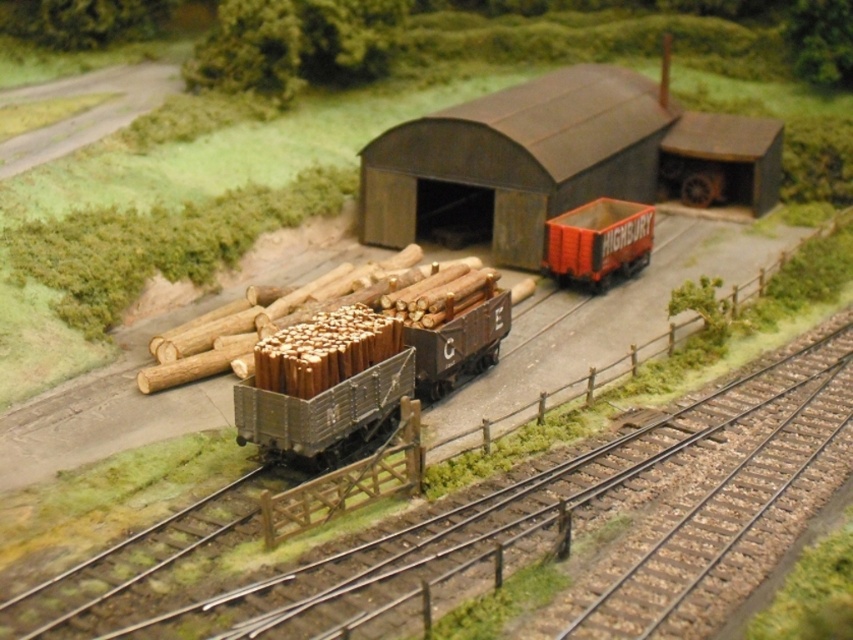
You are a miniature figure standing at the point with coordinates point (602, 234). You want to walk to the point with coordinates point (384, 620). Which direction should you move relative to your current position?

You should move forward because point (384, 620) is in front of point (602, 234).

You are a toy train operator who needs to move a new wagon through the space between the dark gray corrugated metal barn at center and the orange plastic truck at center. The wagon is 3.5 feet wide. Will it fit through the space?

The distance between the dark gray corrugated metal barn at center and the orange plastic truck at center is 3.79 feet. Since the wagon is 3.5 feet wide, it will fit through the space as there is enough clearance.

You are a model train enthusiast planning to place a new locomotive that is 20 feet long on the track. The locomotive needs at least 25 feet of clear space in front of it to safely stop. Is there enough space between the metal track at center and the orange plastic truck at center to accommodate this requirement?

The distance between the metal track at center and the orange plastic truck at center is 24.06 feet, which is less than the required 25 feet. Therefore, there isn not enough space for the locomotive to safely stop.